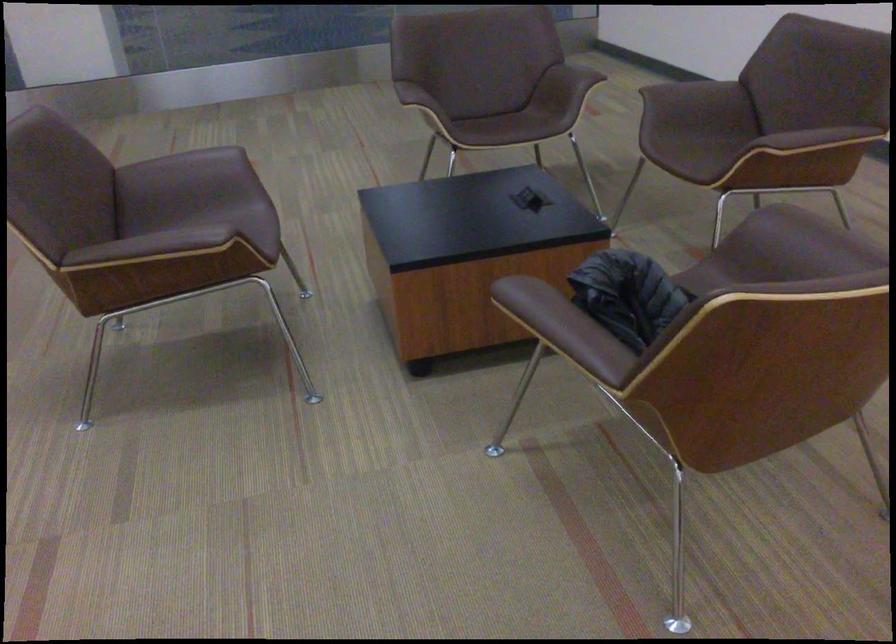
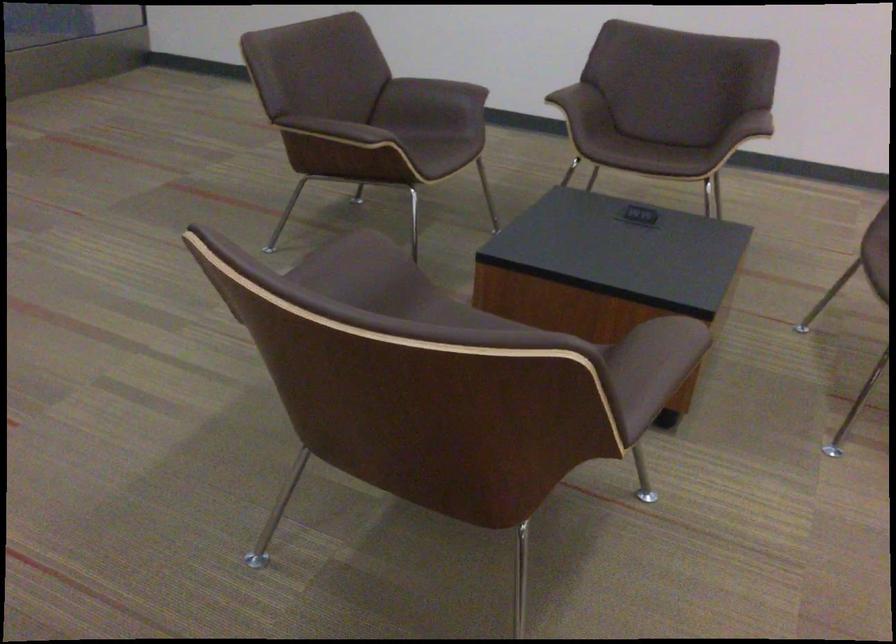
Where in the second image is the point corresponding to pixel 543 69 from the first image?

(435, 90)